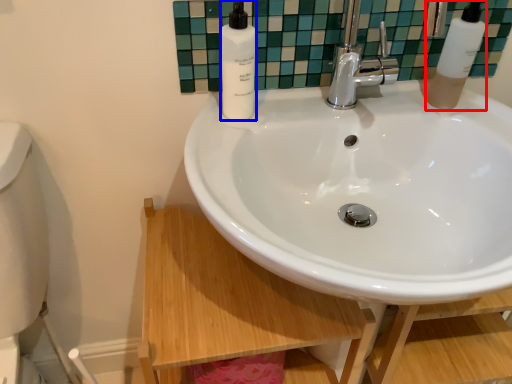
Question: Which object appears farthest to the camera in this image, soap dispenser (highlighted by a red box) or soap dispenser (highlighted by a blue box)?

Choices:
 (A) soap dispenser
 (B) soap dispenser

Answer: (A)